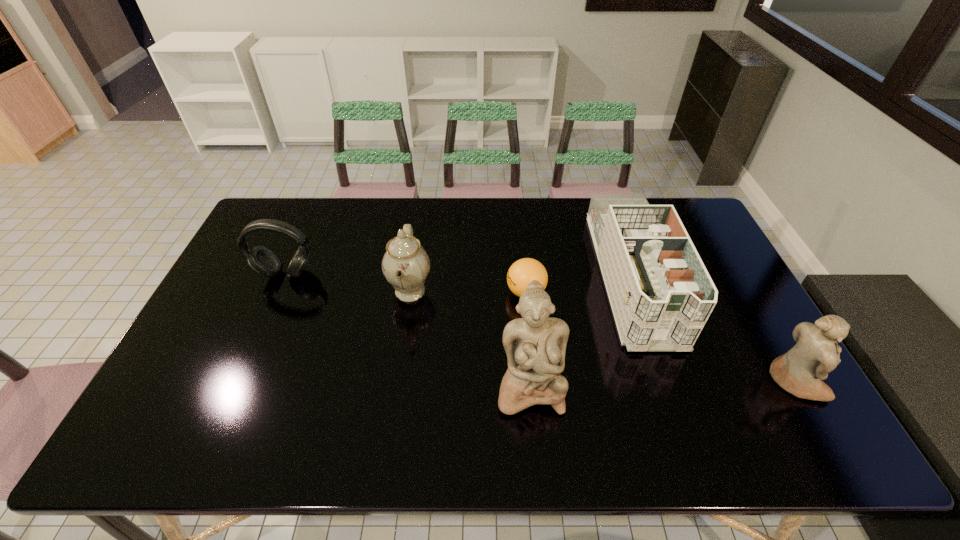
Please show where to add a figurine on the left while keeping spacing even. Please provide its 2D coordinates. Your answer should be formatted as a tuple, i.e. [(x, y)], where the tuple contains the x and y coordinates of a point satisfying the conditions above.

[(260, 393)]